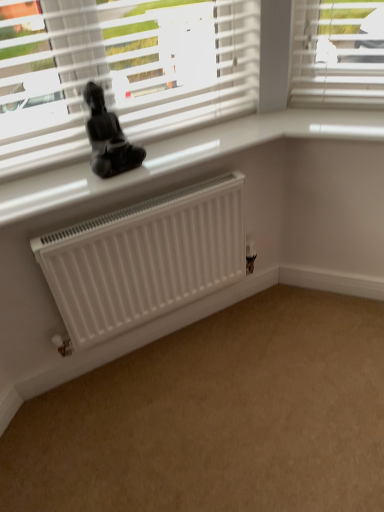
Where is `free point above white matte radiator at lower left (from a real-world perspective)`? This screenshot has width=384, height=512. free point above white matte radiator at lower left (from a real-world perspective) is located at coordinates (208, 413).